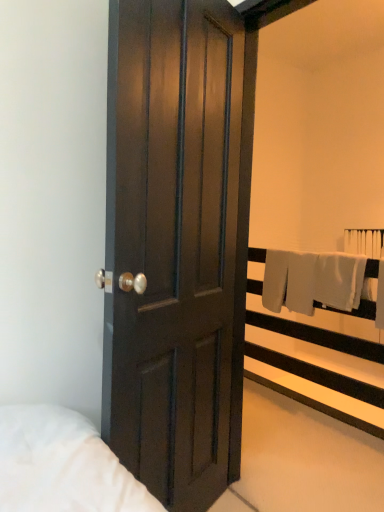
What is the approximate width of dark wood door at center?

dark wood door at center is 5.93 inches in width.

In order to face dark wood door at center, should I rotate leftwards or rightwards?

To face it directly, rotate left by 0.533 degrees.

The image size is (384, 512). I want to click on dark wood door at center, so click(177, 243).

This screenshot has height=512, width=384. Describe the element at coordinates (177, 243) in the screenshot. I see `dark wood door at center` at that location.

Describe the element at coordinates (318, 375) in the screenshot. This screenshot has height=512, width=384. I see `white fabric at upper right` at that location.

The height and width of the screenshot is (512, 384). What are the coordinates of `white fabric at upper right` in the screenshot? It's located at (318, 375).

What is the approximate width of white fabric at upper right?

white fabric at upper right is 8.42 inches wide.

Where is `dark wood door at center`? dark wood door at center is located at coordinates (177, 243).

Is dark wood door at center at the right side of white fabric at upper right?

In fact, dark wood door at center is to the left of white fabric at upper right.

In the scene shown: Which object is closer to the camera, dark wood door at center or white fabric at upper right?

Positioned in front is dark wood door at center.

Which point is more distant from viewer, [155,25] or [368,432]?

Point [368,432]

From the image's perspective, relative to white fabric at upper right, is dark wood door at center above or below?

Based on their image positions, dark wood door at center is located above white fabric at upper right.

From a real-world perspective, which object stands above the other?

From a 3D spatial view, dark wood door at center is above.

From the picture: Can you confirm if dark wood door at center is wider than white fabric at upper right?

No.

From their relative heights in the image, would you say dark wood door at center is taller or shorter than white fabric at upper right?

In the image, dark wood door at center appears to be taller than white fabric at upper right.

Does dark wood door at center have a larger size compared to white fabric at upper right?

Actually, dark wood door at center might be smaller than white fabric at upper right.

Is white fabric at upper right a part of dark wood door at center?

Definitely not — white fabric at upper right is not inside dark wood door at center.

Are dark wood door at center and white fabric at upper right located far from each other?

dark wood door at center is positioned a significant distance from white fabric at upper right.

Is dark wood door at center oriented towards white fabric at upper right?

No, dark wood door at center is not facing towards white fabric at upper right.

In the image, there is a dark wood door at center. Identify the location of balustrade below it (from a real-world perspective). Image resolution: width=384 pixels, height=512 pixels. (318, 375).

Considering the relative positions of white fabric at upper right and dark wood door at center in the image provided, is white fabric at upper right to the right of dark wood door at center from the viewer's perspective?

Yes.

Does white fabric at upper right come in front of dark wood door at center?

No, it is behind dark wood door at center.

Is point (264, 348) closer to viewer compared to point (117, 269)?

No, it is not.

From the image's perspective, is white fabric at upper right under dark wood door at center?

Yes.

From a real-world perspective, is white fabric at upper right positioned under dark wood door at center based on gravity?

Indeed, from a real-world perspective, white fabric at upper right is positioned beneath dark wood door at center.

In the scene shown: Considering the sizes of white fabric at upper right and dark wood door at center in the image, is white fabric at upper right wider or thinner than dark wood door at center?

white fabric at upper right is wider than dark wood door at center.

Considering the sizes of white fabric at upper right and dark wood door at center in the image, is white fabric at upper right taller or shorter than dark wood door at center?

Considering their sizes, white fabric at upper right has less height than dark wood door at center.

Consider the image. Considering the sizes of white fabric at upper right and dark wood door at center in the image, is white fabric at upper right bigger or smaller than dark wood door at center?

white fabric at upper right is bigger than dark wood door at center.

Is white fabric at upper right positioned beyond the bounds of dark wood door at center?

Indeed, white fabric at upper right is completely outside dark wood door at center.

Is white fabric at upper right far away from dark wood door at center?

white fabric at upper right is positioned a significant distance from dark wood door at center.

Is white fabric at upper right positioned with its back to dark wood door at center?

white fabric at upper right does not have its back to dark wood door at center.

Image resolution: width=384 pixels, height=512 pixels. I want to click on door located on the left of white fabric at upper right, so click(177, 243).

Locate an element on the screen. door above the white fabric at upper right (from the image's perspective) is located at coordinates (177, 243).

Image resolution: width=384 pixels, height=512 pixels. In order to click on door above the white fabric at upper right (from a real-world perspective) in this screenshot , I will do (x=177, y=243).